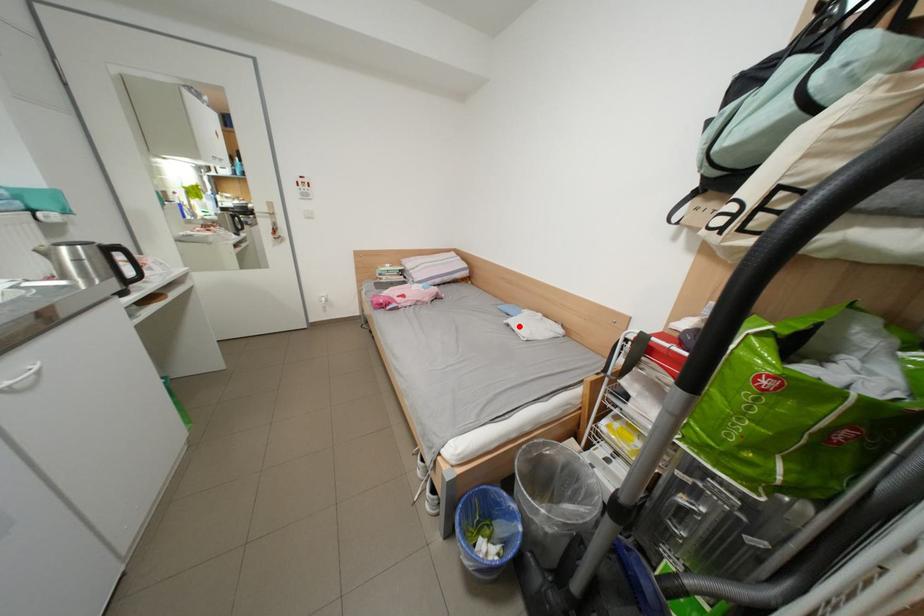
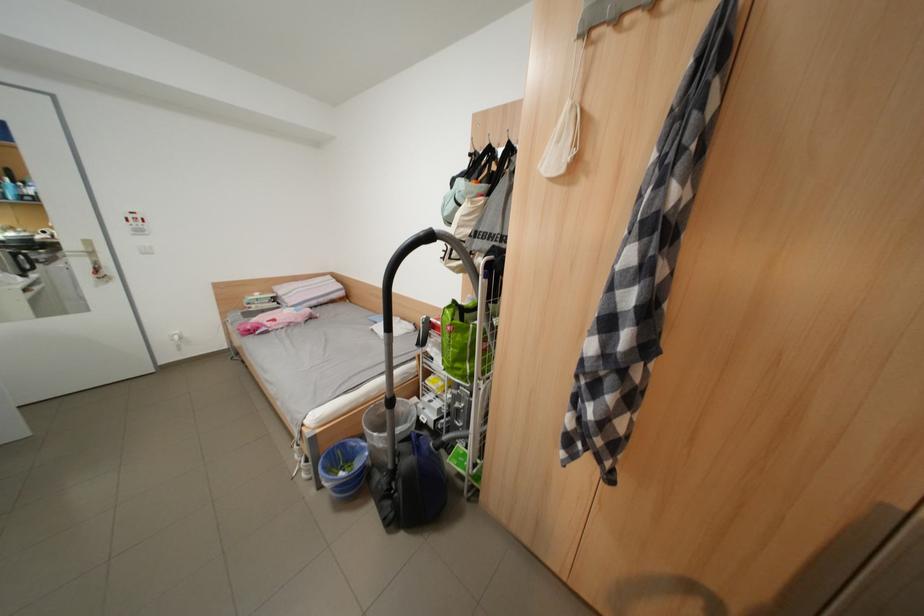
In the second image, find the point that corresponds to the highlighted location in the first image.

(383, 331)